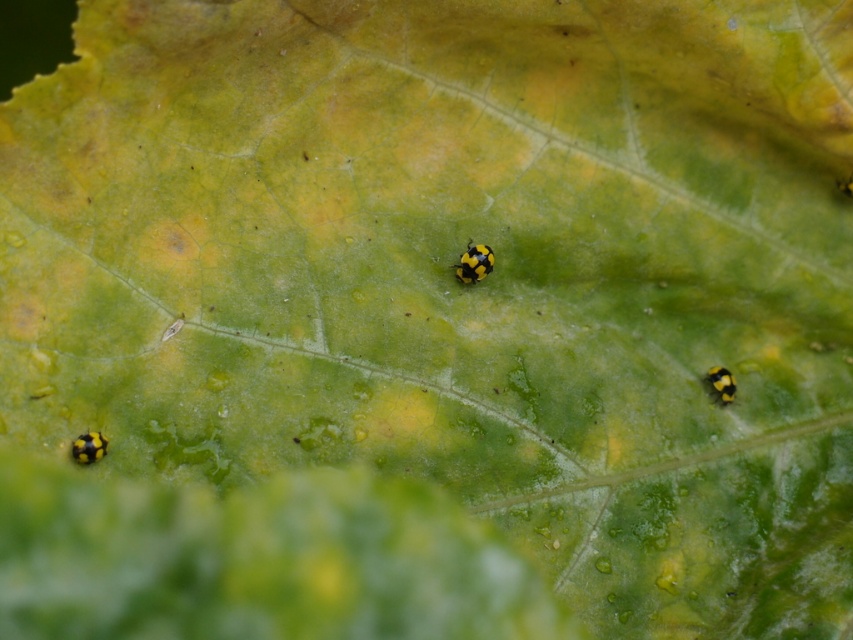
Is point (477, 257) positioned before point (105, 440)?

No, (477, 257) is further to viewer.

Who is taller, yellow matte beetle at center or yellow matte insect at bottom left?

Standing taller between the two is yellow matte beetle at center.

Is point (462, 252) more distant than point (78, 448)?

That is True.

Identify the location of yellow matte beetle at center. (474, 262).

Which is in front, point (459, 262) or point (729, 372)?

Positioned in front is point (729, 372).

Is yellow matte beetle at center wider than yellow matte/black textured caterpillar at lower right?

Correct, the width of yellow matte beetle at center exceeds that of yellow matte/black textured caterpillar at lower right.

What do you see at coordinates (474, 262) in the screenshot? The width and height of the screenshot is (853, 640). I see `yellow matte beetle at center` at bounding box center [474, 262].

Identify the location of yellow matte beetle at center. (474, 262).

Is yellow matte insect at bottom left further to camera compared to yellow matte/black textured caterpillar at lower right?

No, it is in front of yellow matte/black textured caterpillar at lower right.

Who is more distant from viewer, (97, 436) or (730, 381)?

Positioned behind is point (730, 381).

At what (x,y) coordinates should I click in order to perform the action: click on yellow matte insect at bottom left. Please return your answer as a coordinate pair (x, y). Looking at the image, I should click on (88, 448).